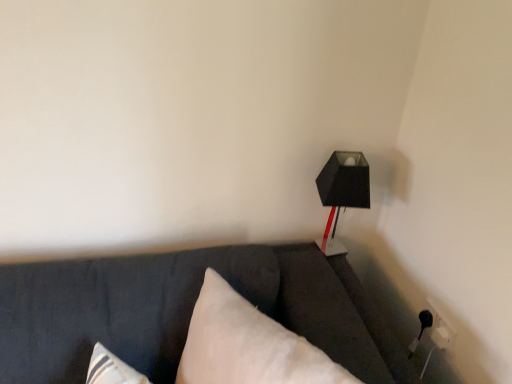
What is the approximate height of black matte lamp at upper right?

15.24 inches.

What do you see at coordinates (342, 192) in the screenshot? This screenshot has width=512, height=384. I see `black matte lamp at upper right` at bounding box center [342, 192].

Locate an element on the screen. black matte lamp at upper right is located at coordinates (342, 192).

What is the approximate width of white soft pillow at center?

white soft pillow at center is 26.05 centimeters wide.

Where is `white soft pillow at center`? white soft pillow at center is located at coordinates (248, 345).

What do you see at coordinates (248, 345) in the screenshot? This screenshot has width=512, height=384. I see `white soft pillow at center` at bounding box center [248, 345].

At what (x,y) coordinates should I click in order to perform the action: click on black matte lamp at upper right. Please return your answer as a coordinate pair (x, y). Looking at the image, I should click on (342, 192).

In the scene shown: Considering the relative positions of black matte lamp at upper right and white soft pillow at center in the image provided, is black matte lamp at upper right to the left of white soft pillow at center from the viewer's perspective?

Incorrect, black matte lamp at upper right is not on the left side of white soft pillow at center.

Between black matte lamp at upper right and white soft pillow at center, which one is positioned in front?

white soft pillow at center.

Is point (327, 194) more distant than point (237, 328)?

Yes, it is behind point (237, 328).

Consider the image. From the image's perspective, relative to white soft pillow at center, is black matte lamp at upper right above or below?

Clearly, from the image's perspective, black matte lamp at upper right is above white soft pillow at center.

From a real-world perspective, which is physically below, black matte lamp at upper right or white soft pillow at center?

white soft pillow at center.

Which object is thinner, black matte lamp at upper right or white soft pillow at center?

Thinner between the two is black matte lamp at upper right.

Who is taller, black matte lamp at upper right or white soft pillow at center?

white soft pillow at center.

Considering the relative sizes of black matte lamp at upper right and white soft pillow at center in the image provided, is black matte lamp at upper right smaller than white soft pillow at center?

Correct, black matte lamp at upper right occupies less space than white soft pillow at center.

Is black matte lamp at upper right surrounding white soft pillow at center?

Actually, white soft pillow at center is outside black matte lamp at upper right.

Would you consider black matte lamp at upper right to be distant from white soft pillow at center?

No.

Is black matte lamp at upper right oriented away from white soft pillow at center?

black matte lamp at upper right is not turned away from white soft pillow at center.

The image size is (512, 384). Identify the location of lamp behind the white soft pillow at center. (342, 192).

Which object is positioned more to the right, white soft pillow at center or black matte lamp at upper right?

black matte lamp at upper right.

Which object is closer to the camera taking this photo, white soft pillow at center or black matte lamp at upper right?

white soft pillow at center is more forward.

Which is behind, point (214, 289) or point (353, 166)?

The point (353, 166) is farther.

From the image's perspective, which is above, white soft pillow at center or black matte lamp at upper right?

From the image's view, black matte lamp at upper right is above.

From a real-world perspective, who is located lower, white soft pillow at center or black matte lamp at upper right?

white soft pillow at center is physically lower.

Considering the relative sizes of white soft pillow at center and black matte lamp at upper right in the image provided, is white soft pillow at center thinner than black matte lamp at upper right?

No.

Considering the sizes of objects white soft pillow at center and black matte lamp at upper right in the image provided, who is taller, white soft pillow at center or black matte lamp at upper right?

Standing taller between the two is white soft pillow at center.

In the scene shown: Considering the relative sizes of white soft pillow at center and black matte lamp at upper right in the image provided, is white soft pillow at center smaller than black matte lamp at upper right?

Actually, white soft pillow at center might be larger than black matte lamp at upper right.

Is black matte lamp at upper right completely or partially inside white soft pillow at center?

No, black matte lamp at upper right is located outside of white soft pillow at center.

Would you consider white soft pillow at center to be distant from black matte lamp at upper right?

That's not correct — white soft pillow at center is a little close to black matte lamp at upper right.

Could you tell me if white soft pillow at center is facing black matte lamp at upper right?

No.

How many degrees apart are the facing directions of white soft pillow at center and black matte lamp at upper right?

The angular difference between white soft pillow at center and black matte lamp at upper right is 61 degrees.

Locate an element on the screen. pillow that is under the black matte lamp at upper right (from a real-world perspective) is located at coordinates (x=248, y=345).

You are a GUI agent. You are given a task and a screenshot of the screen. Output one action in this format:
    pyautogui.click(x=<x>, y=<y>)
    Task: Click on the lamp located above the white soft pillow at center (from the image's perspective)
    This screenshot has width=512, height=384.
    Given the screenshot: What is the action you would take?
    pyautogui.click(x=342, y=192)

The height and width of the screenshot is (384, 512). In order to click on pillow below the black matte lamp at upper right (from the image's perspective) in this screenshot , I will do `click(248, 345)`.